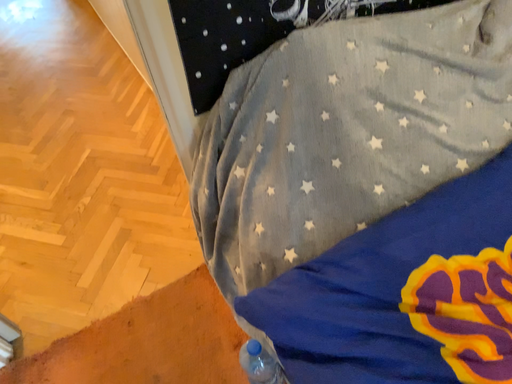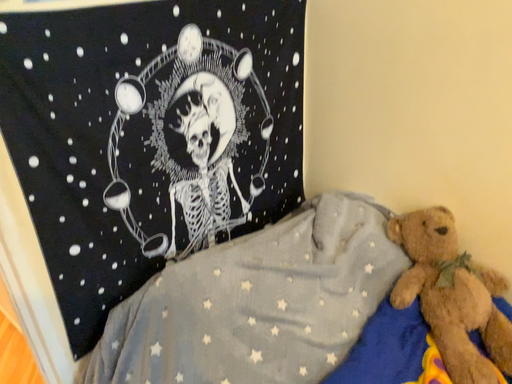
Question: How did the camera likely rotate when shooting the video?

Choices:
 (A) rotated downward
 (B) rotated upward

Answer: (B)